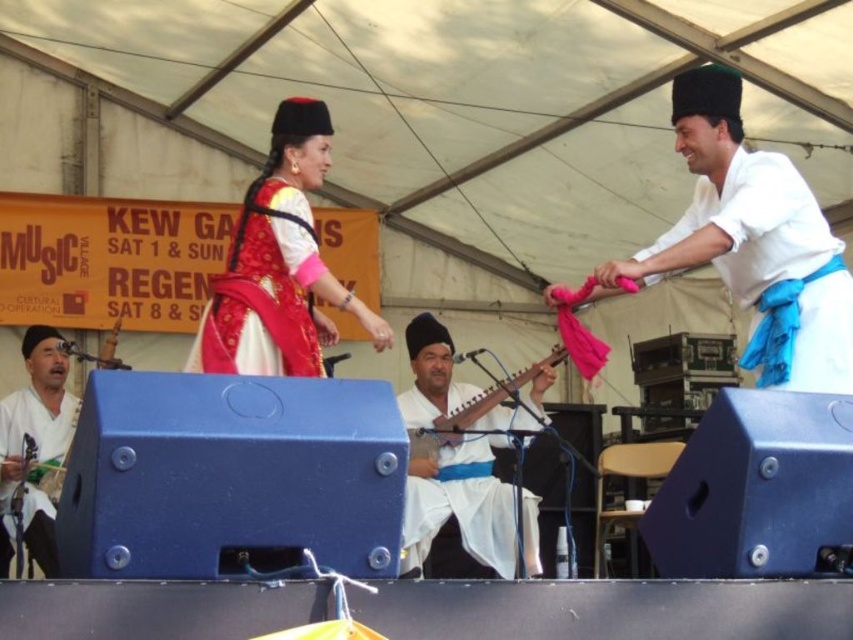
You are a photographer standing at the edge of the tent. You want to capture a photo of both the white cotton shirt at upper right and the matte red fabric dress at center in the same frame. The camera you have can focus on subjects within a 2.5 meter range. Will both subjects be in focus?

The white cotton shirt at upper right is 1.59 meters away from the matte red fabric dress at center. Since the camera can focus within a 2.5 meter range, both subjects will be in focus as the distance between them is less than the camera range.